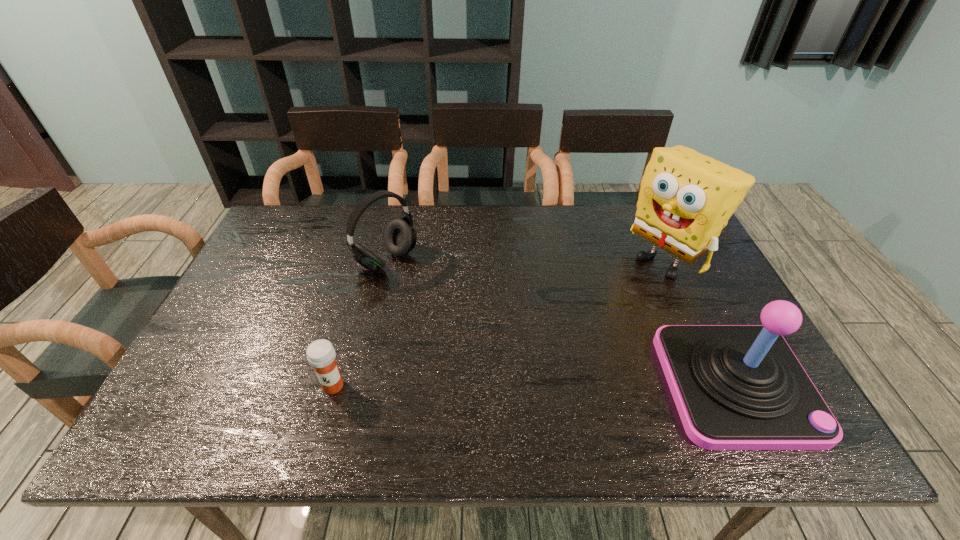
In order to click on the shortest object in this screenshot , I will do `click(321, 355)`.

The width and height of the screenshot is (960, 540). Identify the location of joystick. (736, 387).

You are a GUI agent. You are given a task and a screenshot of the screen. Output one action in this format:
    pyautogui.click(x=<x>, y=<y>)
    Task: Click on the tallest object
    The height and width of the screenshot is (540, 960).
    Given the screenshot: What is the action you would take?
    click(686, 198)

Find the location of a particular element. headset is located at coordinates (400, 237).

Find the location of a particular element. This screenshot has height=540, width=960. free space located on the face of the sponge is located at coordinates (566, 327).

Find the location of a particular element. The image size is (960, 540). blank space located 0.070m on the face of the sponge is located at coordinates (626, 288).

Identify the location of free space located on the face of the sponge. (556, 335).

I want to click on vacant region located 0.070m on the ear cups of the headset, so click(423, 287).

The image size is (960, 540). I want to click on free location located 0.110m on the ear cups of the headset, so click(433, 293).

The image size is (960, 540). What are the coordinates of `blank space located on the ear cups of the headset` in the screenshot? It's located at (510, 346).